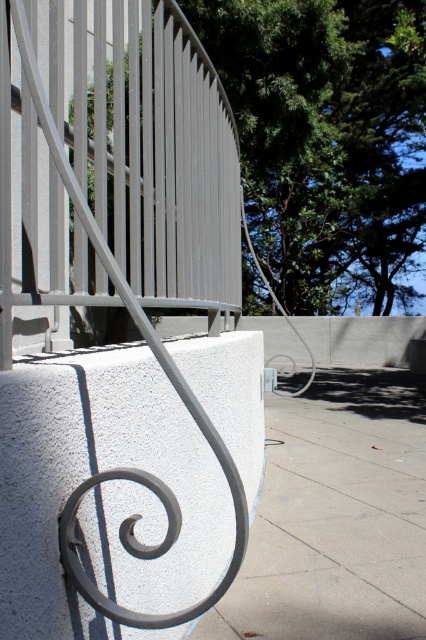
How far apart are white textured concrete at center and gray concrete sidewalk at center?

white textured concrete at center is 1.29 meters from gray concrete sidewalk at center.

What are the coordinates of `white textured concrete at center` in the screenshot? It's located at (103, 492).

I want to click on white textured concrete at center, so click(103, 492).